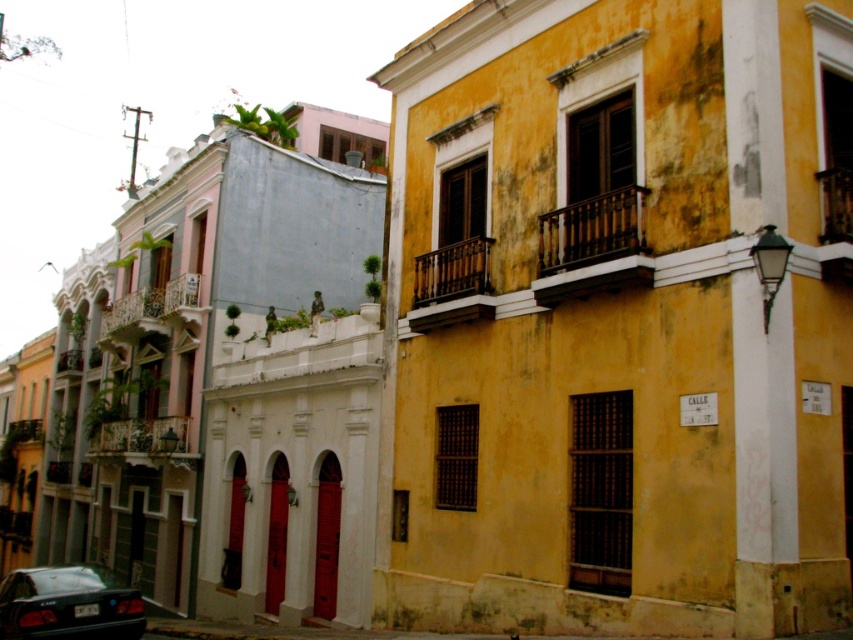
Is wooden at center thinner than wooden at left?

Indeed, wooden at center has a lesser width compared to wooden at left.

Does wooden at center appear under wooden at left?

No.

At what (x,y) coordinates should I click in order to perform the action: click on wooden at center. Please return your answer as a coordinate pair (x, y). The width and height of the screenshot is (853, 640). Looking at the image, I should click on (451, 285).

You are a GUI agent. You are given a task and a screenshot of the screen. Output one action in this format:
    pyautogui.click(x=<x>, y=<y>)
    Task: Click on the wooden at upper center
    
    Given the screenshot: What is the action you would take?
    pyautogui.click(x=592, y=246)

Is point (558, 220) positioned before point (119, 428)?

Yes, point (558, 220) is in front of point (119, 428).

Is point (561, 298) behind point (163, 435)?

No, (561, 298) is in front of (163, 435).

What are the coordinates of `wooden at upper center` in the screenshot? It's located at (592, 246).

Who is lower down, shiny black sedan at lower left or wooden at left?

shiny black sedan at lower left is lower down.

Does point (32, 630) lie behind point (184, 467)?

No.

Find the location of `shiny black sedan at lower left`. shiny black sedan at lower left is located at coordinates (67, 605).